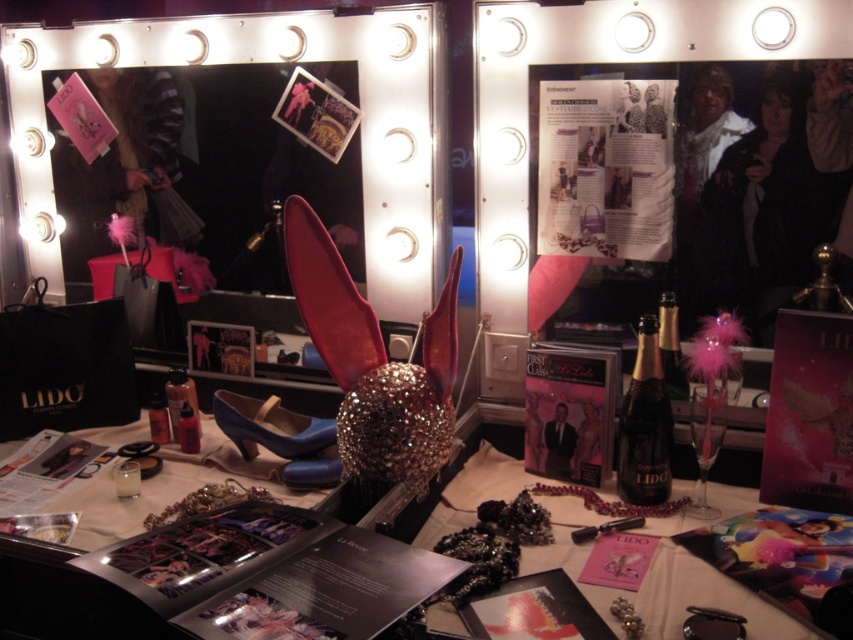
You are standing in the middle of the room and want to locate the metallic silver mirror at center. According to the coordinates provided, where should you look relative to your current position?

The metallic silver mirror at center is located at coordinates point (271, 61), which means it is positioned to the lower left of your current position in the room.

You are a dancer preparing for a performance and see the metallic silver mirror at center and the blue patent leather shoe at center in your dressing room. Which object is positioned higher in the scene?

The metallic silver mirror at center is located above the blue patent leather shoe at center, so it is positioned higher in the scene.